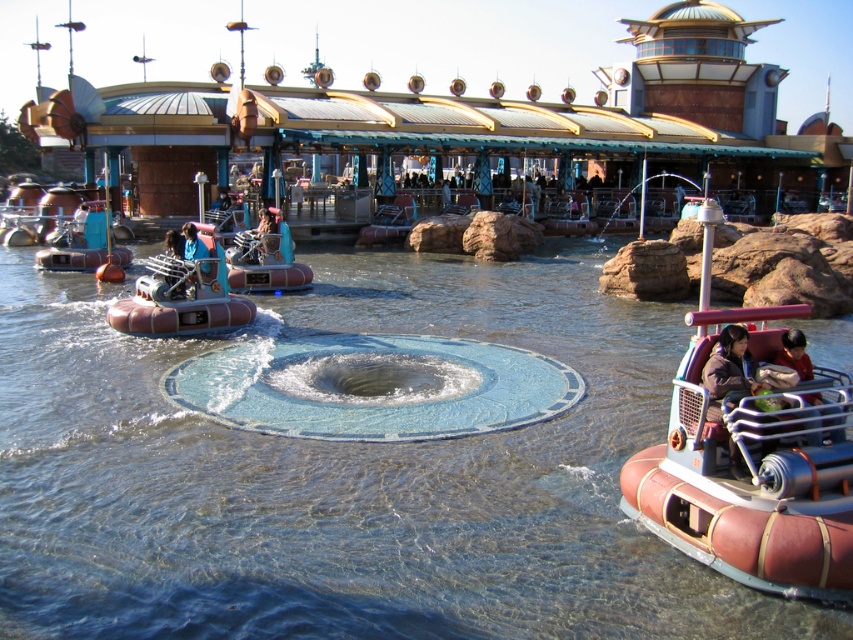
Question: Based on their relative distances, which object is farther from the blue fabric person at center?

Choices:
 (A) brown rubber boat at center
 (B) matte brown hovercraft at left

Answer: (A)

Question: Does brown rubber boat at center have a smaller size compared to matte brown hovercraft at left?

Choices:
 (A) yes
 (B) no

Answer: (B)

Question: Which object is the closest to the blue fabric person at center?

Choices:
 (A) brown rubber boat at center
 (B) rustic brown hovercraft at center

Answer: (B)

Question: Estimate the real-world distances between objects in this image. Which object is farther from the matte brown hovercraft at left?

Choices:
 (A) brown rubber boat at center
 (B) blue fabric person at center
 (C) rustic brown hovercraft at center

Answer: (A)

Question: Considering the relative positions of matte brown hovercraft at left and blue fabric person at center in the image provided, where is matte brown hovercraft at left located with respect to blue fabric person at center?

Choices:
 (A) above
 (B) below

Answer: (B)

Question: Can you confirm if matte brown hovercraft at left is wider than blue fabric person at center?

Choices:
 (A) no
 (B) yes

Answer: (A)